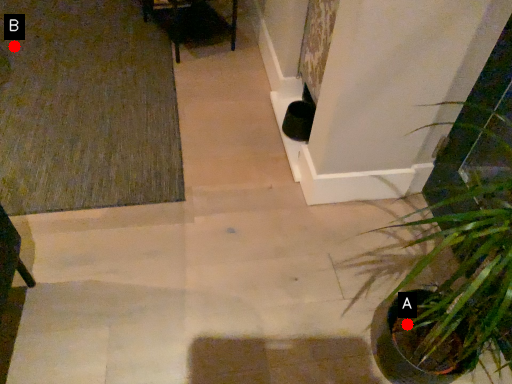
Question: Two points are circled on the image, labeled by A and B beside each circle. Which point is farther to the camera?

Choices:
 (A) A is further
 (B) B is further

Answer: (B)